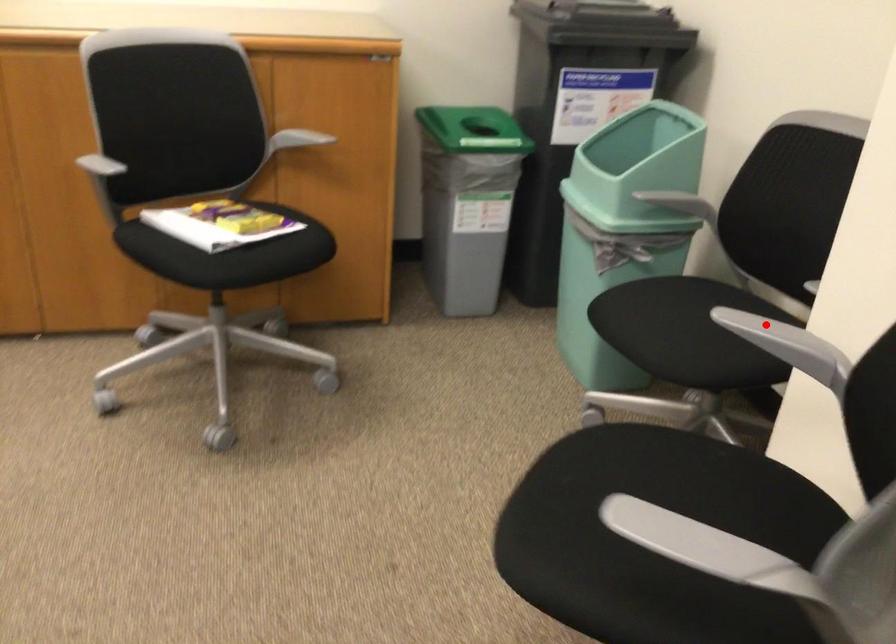
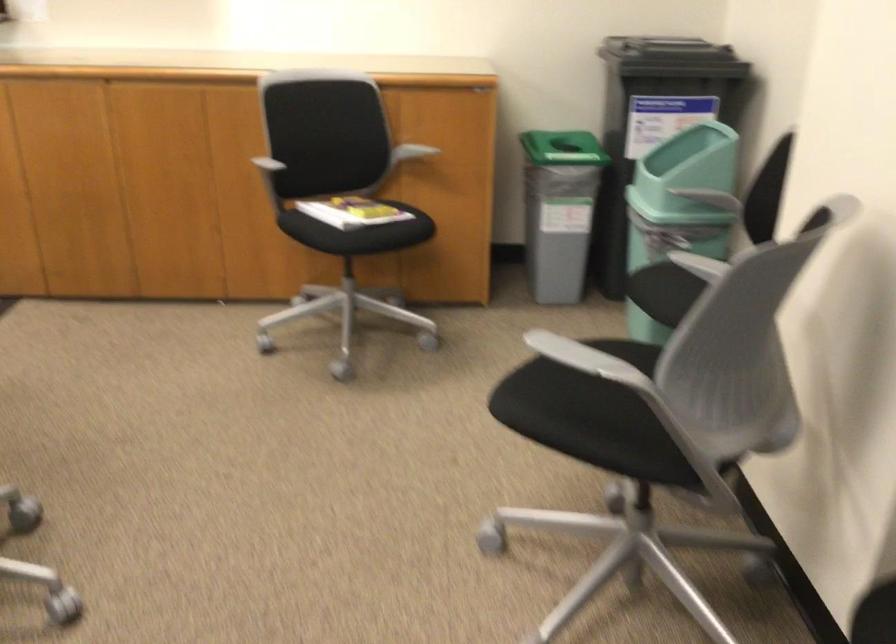
Locate, in the second image, the point that corresponds to the highlighted location in the first image.

(705, 263)